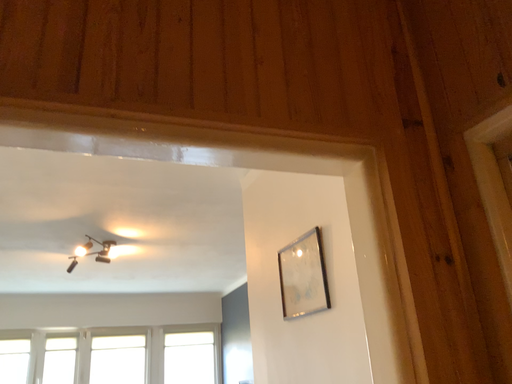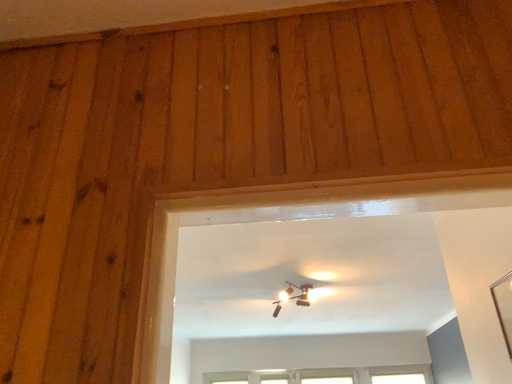
Question: Which way did the camera rotate in the video?

Choices:
 (A) rotated left
 (B) rotated right

Answer: (A)